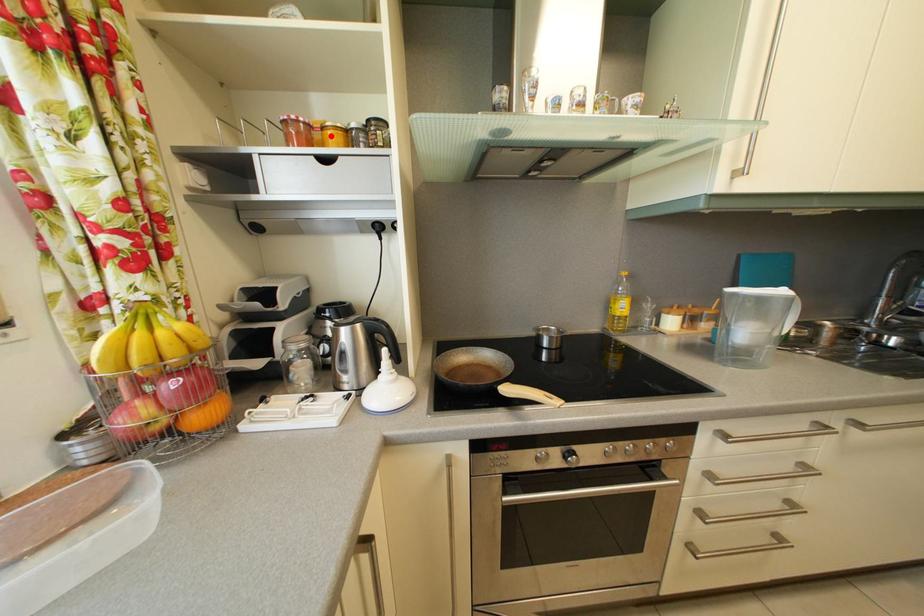
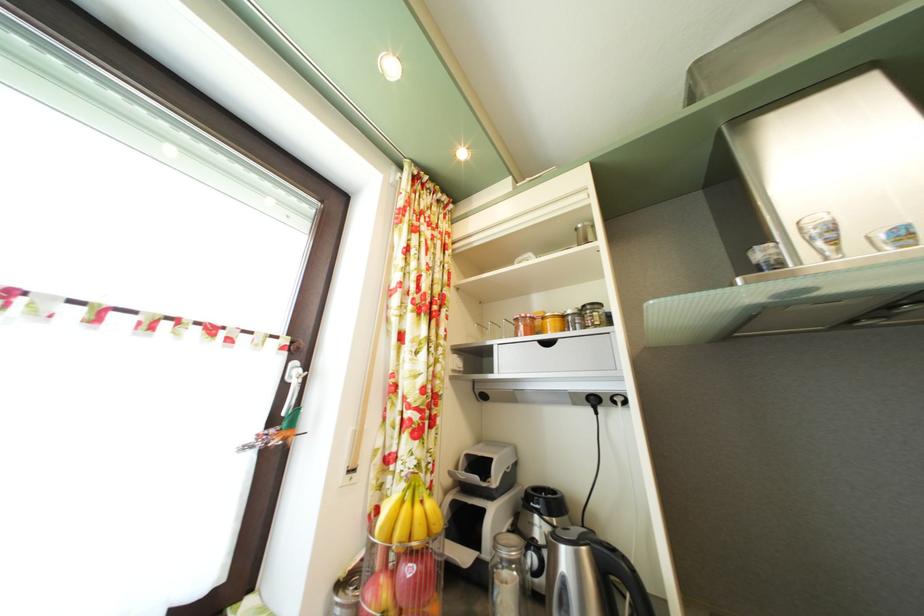
In the second image, find the point that corresponds to the highlighted location in the first image.

(552, 325)